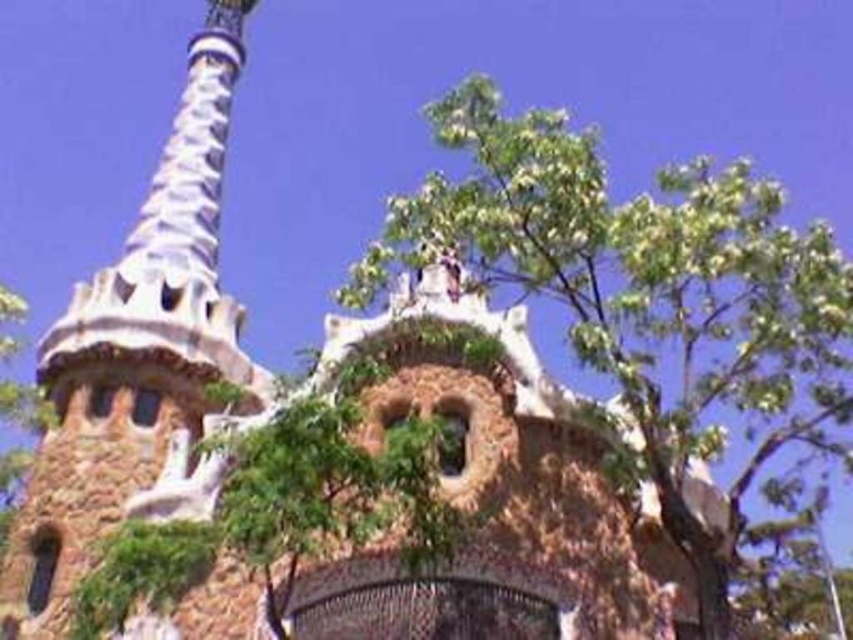
Does green leafy tree at upper center have a larger size compared to brown stone tower at upper left?

Correct, green leafy tree at upper center is larger in size than brown stone tower at upper left.

Does green leafy tree at upper center lie behind brown stone tower at upper left?

No, it is not.

Is point (815, 337) behind point (119, 433)?

No, (815, 337) is in front of (119, 433).

Find the location of a particular element. This screenshot has width=853, height=640. green leafy tree at upper center is located at coordinates (646, 294).